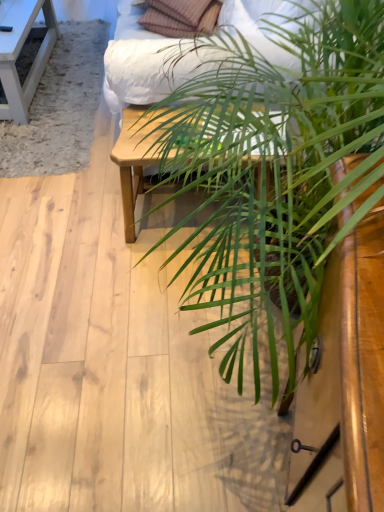
Question: Considering the relative sizes of matte white bed frame at upper center and green leafy plant at center in the image provided, is matte white bed frame at upper center smaller than green leafy plant at center?

Choices:
 (A) no
 (B) yes

Answer: (A)

Question: Is green leafy plant at center inside matte white bed frame at upper center?

Choices:
 (A) no
 (B) yes

Answer: (A)

Question: From a real-world perspective, is matte white bed frame at upper center positioned over green leafy plant at center based on gravity?

Choices:
 (A) yes
 (B) no

Answer: (B)

Question: Would you say matte white bed frame at upper center is a long distance from green leafy plant at center?

Choices:
 (A) yes
 (B) no

Answer: (B)

Question: Does matte white bed frame at upper center have a lesser width compared to green leafy plant at center?

Choices:
 (A) no
 (B) yes

Answer: (A)

Question: Can you confirm if matte white bed frame at upper center is positioned to the left of green leafy plant at center?

Choices:
 (A) yes
 (B) no

Answer: (A)

Question: From the image's perspective, is matte white bed frame at upper center above white wood table at upper left, which appears as the second table when ordered from the bottom?

Choices:
 (A) yes
 (B) no

Answer: (A)

Question: From the image's perspective, does matte white bed frame at upper center appear lower than white wood table at upper left, the 2th table positioned from the front?

Choices:
 (A) yes
 (B) no

Answer: (B)

Question: Is white wood table at upper left, the 1th table positioned from the back, completely or partially inside matte white bed frame at upper center?

Choices:
 (A) yes
 (B) no

Answer: (B)

Question: From a real-world perspective, is matte white bed frame at upper center over white wood table at upper left, the second table in the right-to-left sequence?

Choices:
 (A) yes
 (B) no

Answer: (A)

Question: Can you confirm if matte white bed frame at upper center is smaller than white wood table at upper left, the second table in the right-to-left sequence?

Choices:
 (A) no
 (B) yes

Answer: (A)

Question: Can you confirm if matte white bed frame at upper center is bigger than white wood table at upper left, the 1th table positioned from the back?

Choices:
 (A) yes
 (B) no

Answer: (A)

Question: From a real-world perspective, is plaid fabric pillow at upper center positioned over white wood table at upper left, which appears as the second table when ordered from the bottom, based on gravity?

Choices:
 (A) no
 (B) yes

Answer: (B)